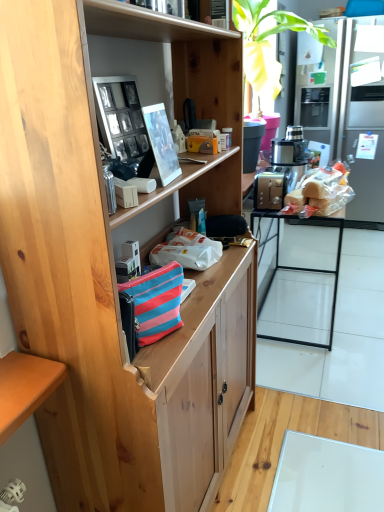
Find the location of a particular element. This screenshot has width=384, height=512. vacant space underneath metallic gold toaster at right (from a real-world perspective) is located at coordinates (300, 304).